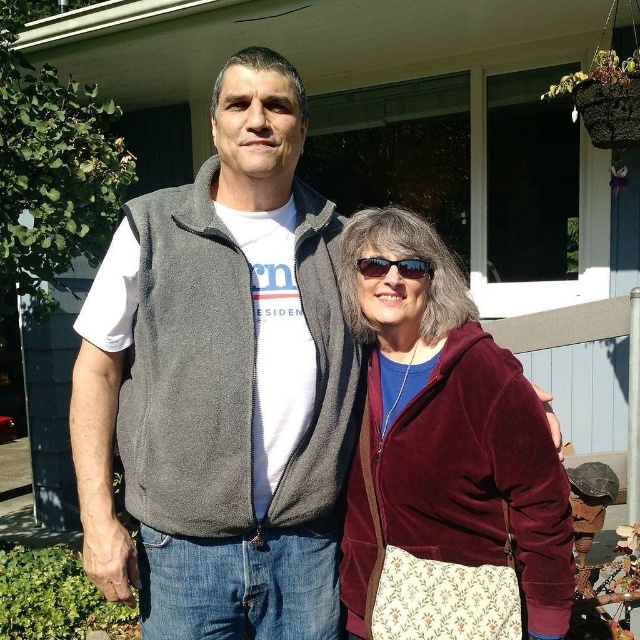
Question: Which point is farther from the camera taking this photo?

Choices:
 (A) (406, 272)
 (B) (429, 372)
 (C) (323, 243)

Answer: (C)

Question: Does velvet maroon jacket at center have a greater width compared to matte black sunglasses at center?

Choices:
 (A) no
 (B) yes

Answer: (B)

Question: Can you confirm if gray fleece vest at center is bigger than velvet maroon jacket at center?

Choices:
 (A) no
 (B) yes

Answer: (B)

Question: Is gray fleece vest at center smaller than matte black sunglasses at center?

Choices:
 (A) no
 (B) yes

Answer: (A)

Question: Which object appears closest to the camera in this image?

Choices:
 (A) matte black sunglasses at center
 (B) velvet maroon jacket at center
 (C) gray fleece vest at center

Answer: (B)

Question: Which point is farther to the camera?

Choices:
 (A) velvet maroon jacket at center
 (B) matte black sunglasses at center
 (C) gray fleece vest at center

Answer: (B)